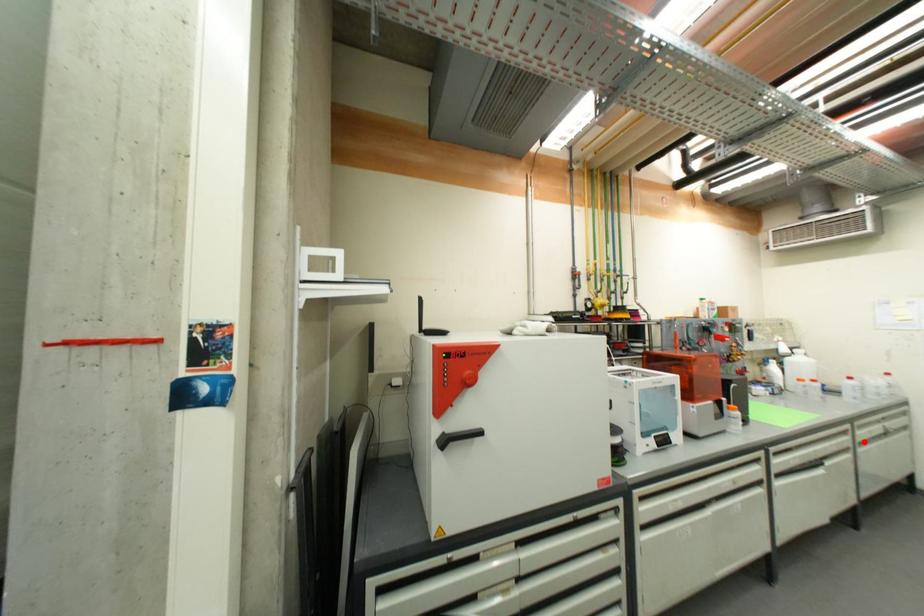
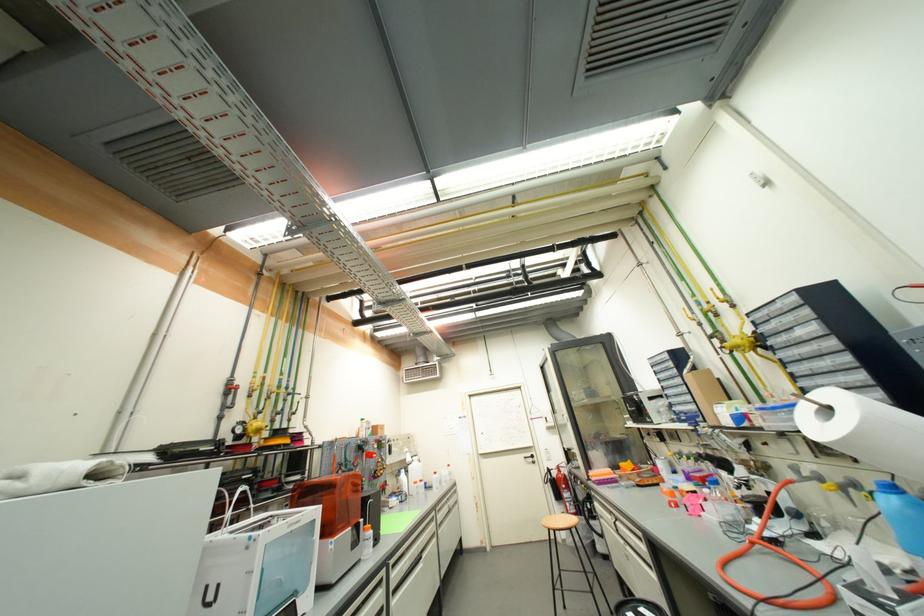
Question: I am providing you with two images of the same scene from different viewpoints. In image1, a red point is highlighted. Considering the same 3D point in image2, which of the following is correct?

Choices:
 (A) It is closer
 (B) It is farther

Answer: (B)